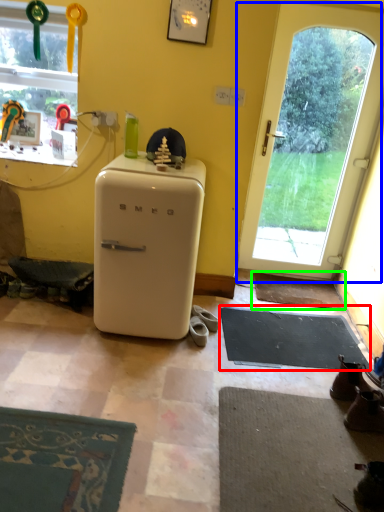
Question: Which object is positioned closest to yoga mat (highlighted by a red box)? Select from door (highlighted by a blue box) and doormat (highlighted by a green box).

Choices:
 (A) door
 (B) doormat

Answer: (B)